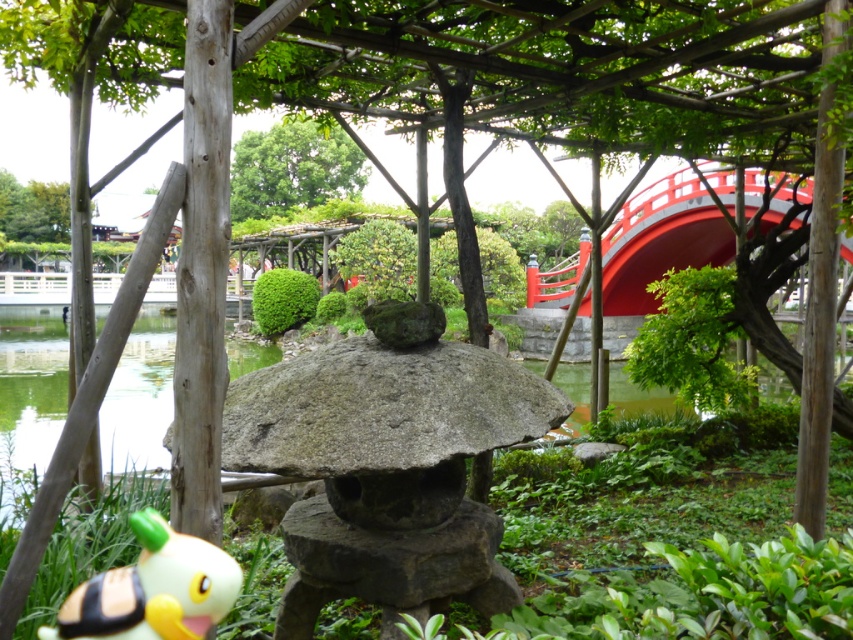
You are standing in the Japanese garden and want to take a photo that includes both the point at coordinates point (583, 364) and point (173, 548). Which point will appear closer to the camera in your photo?

Point (173, 548) will appear closer to the camera in the photo because it is closer to the viewer than point (583, 364), which is further away.

You are a visitor in the Japanese garden and want to take a photo of both the gray stone lantern at center and the green leafy tree at upper center. Which object should you focus on first if you want to include both in the same frame without moving your camera?

The gray stone lantern at center is shorter than the green leafy tree at upper center, so you should focus on the gray stone lantern at center first to ensure both are in frame.